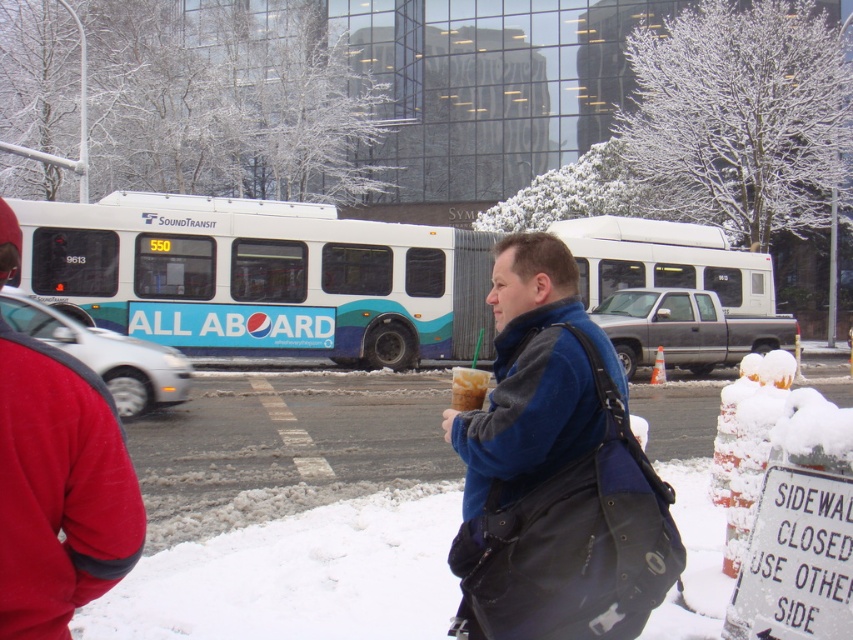
Question: Which of the following is the farthest from the observer?

Choices:
 (A) (456, 397)
 (B) (28, 260)

Answer: (B)

Question: Does white glossy bus at upper center appear under red fleece jacket at left?

Choices:
 (A) yes
 (B) no

Answer: (B)

Question: Does white glossy bus at upper center have a larger size compared to blue fleece jacket at center?

Choices:
 (A) no
 (B) yes

Answer: (B)

Question: Can you confirm if red fleece jacket at left is bigger than matte plastic cup at center?

Choices:
 (A) yes
 (B) no

Answer: (B)

Question: Estimate the real-world distances between objects in this image. Which object is farther from the red fleece jacket at left?

Choices:
 (A) blue fleece jacket at center
 (B) matte plastic cup at center
 (C) white glossy bus at upper center

Answer: (C)

Question: Which point appears farthest from the camera in this image?

Choices:
 (A) click(12, 442)
 (B) click(610, 540)
 (C) click(471, 385)
 (D) click(708, 362)

Answer: (D)